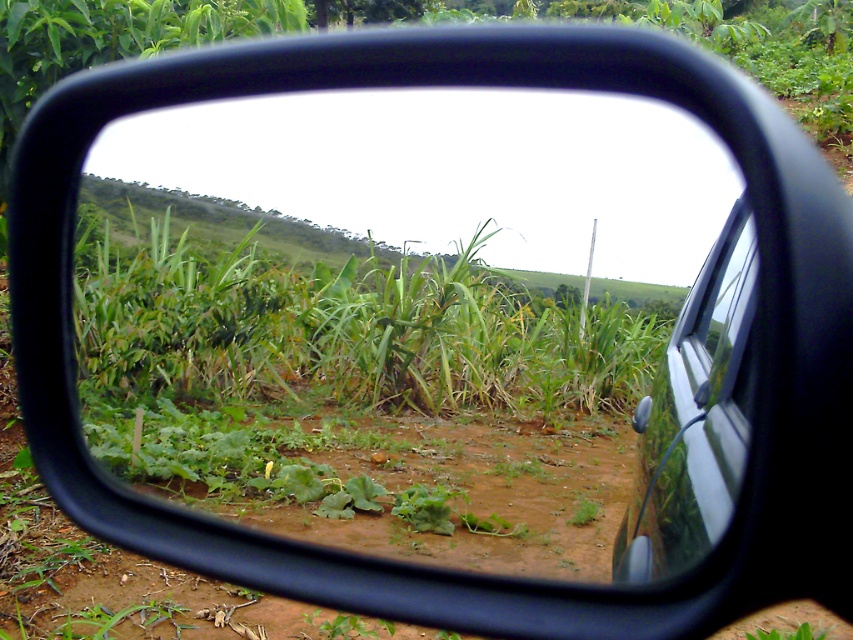
Can you confirm if green leafy corn field at center is positioned above transparent glass car window at right?

Correct, green leafy corn field at center is located above transparent glass car window at right.

Is point (641, 342) closer to viewer compared to point (674, 364)?

No.

Where is `green leafy corn field at center`? The height and width of the screenshot is (640, 853). green leafy corn field at center is located at coordinates (343, 321).

Is green leafy corn field at center shorter than silver metallic car at right?

No, green leafy corn field at center is not shorter than silver metallic car at right.

Is green leafy corn field at center to the right of silver metallic car at right from the viewer's perspective?

In fact, green leafy corn field at center is to the left of silver metallic car at right.

Describe the element at coordinates (343, 321) in the screenshot. I see `green leafy corn field at center` at that location.

The image size is (853, 640). Identify the location of green leafy corn field at center. (343, 321).

Can you confirm if silver metallic car at right is positioned above transparent glass car window at right?

Actually, silver metallic car at right is below transparent glass car window at right.

Does silver metallic car at right appear on the right side of transparent glass car window at right?

In fact, silver metallic car at right is to the left of transparent glass car window at right.

Between point (741, 230) and point (683, 346), which one is positioned behind?

Positioned behind is point (683, 346).

Where is `silver metallic car at right`? silver metallic car at right is located at coordinates (695, 417).